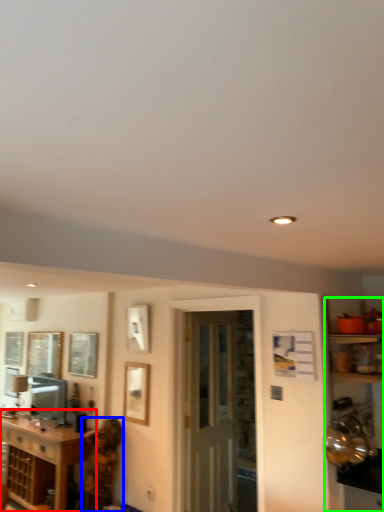
Question: Estimate the real-world distances between objects in this image. Which object is farther from cabinetry (highlighted by a red box), person (highlighted by a blue box) or entertainment center (highlighted by a green box)?

Choices:
 (A) person
 (B) entertainment center

Answer: (B)